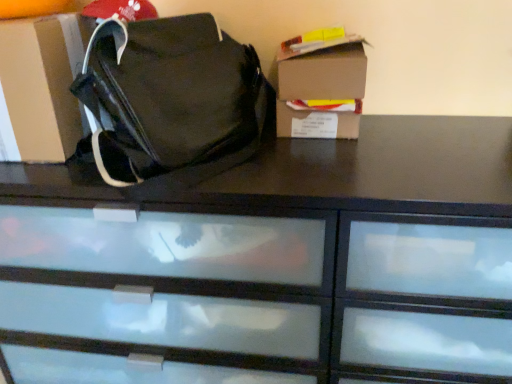
Question: Can you confirm if cardboard box at upper right is bigger than matte black bag at center?

Choices:
 (A) no
 (B) yes

Answer: (A)

Question: From the image's perspective, is cardboard box at upper right below matte black bag at center?

Choices:
 (A) no
 (B) yes

Answer: (B)

Question: Does cardboard box at upper right have a greater height compared to matte black bag at center?

Choices:
 (A) yes
 (B) no

Answer: (B)

Question: From the image's perspective, is cardboard box at upper right on matte black bag at center?

Choices:
 (A) no
 (B) yes

Answer: (A)

Question: Is cardboard box at upper right shorter than matte black bag at center?

Choices:
 (A) yes
 (B) no

Answer: (A)

Question: Based on their sizes in the image, would you say cardboard box at left is bigger or smaller than cardboard box at upper right?

Choices:
 (A) big
 (B) small

Answer: (A)

Question: Is cardboard box at left inside the boundaries of cardboard box at upper right, or outside?

Choices:
 (A) inside
 (B) outside

Answer: (B)

Question: Considering the positions of cardboard box at left and cardboard box at upper right in the image, is cardboard box at left wider or thinner than cardboard box at upper right?

Choices:
 (A) wide
 (B) thin

Answer: (A)

Question: In the image, is cardboard box at left positioned in front of or behind cardboard box at upper right?

Choices:
 (A) front
 (B) behind

Answer: (A)

Question: From their relative heights in the image, would you say cardboard box at upper right is taller or shorter than cardboard box at left?

Choices:
 (A) short
 (B) tall

Answer: (A)

Question: Relative to cardboard box at left, is cardboard box at upper right in front or behind?

Choices:
 (A) behind
 (B) front

Answer: (A)

Question: Based on their sizes in the image, would you say cardboard box at upper right is bigger or smaller than cardboard box at left?

Choices:
 (A) big
 (B) small

Answer: (B)

Question: From the image's perspective, relative to cardboard box at left, is cardboard box at upper right above or below?

Choices:
 (A) below
 (B) above

Answer: (A)

Question: Considering the positions of matte black bag at center and cardboard box at left in the image, is matte black bag at center bigger or smaller than cardboard box at left?

Choices:
 (A) big
 (B) small

Answer: (A)

Question: Would you say matte black bag at center is to the left or to the right of cardboard box at left in the picture?

Choices:
 (A) right
 (B) left

Answer: (A)